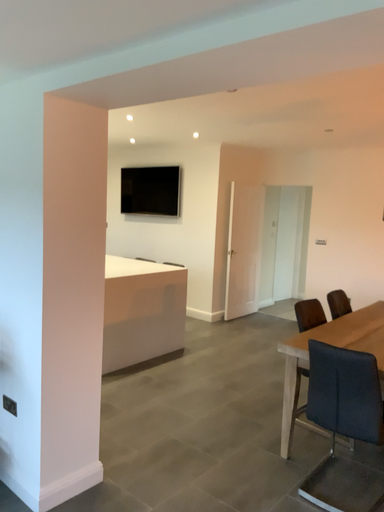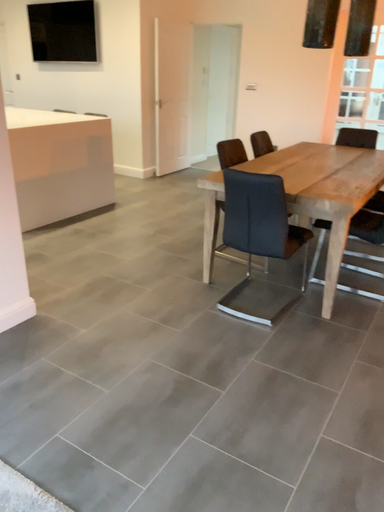
Question: How did the camera likely rotate when shooting the video?

Choices:
 (A) rotated left
 (B) rotated right

Answer: (B)